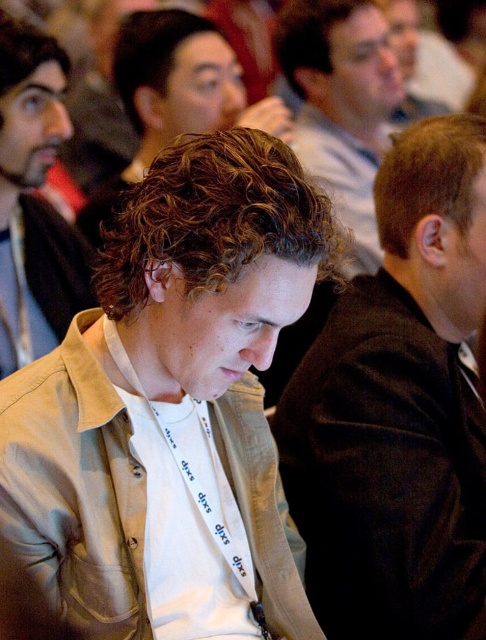
Is beige fabric shirt at center further to the viewer compared to light brown jacket at center?

That is False.

Does point (194, 532) lie behind point (36, 106)?

No, it is not.

The height and width of the screenshot is (640, 486). I want to click on beige fabric shirt at center, so click(x=172, y=406).

Identify the location of light brown jacket at center. Image resolution: width=486 pixels, height=640 pixels. (34, 200).

Between point (52, 337) and point (400, 100), which one is positioned in front?

Positioned in front is point (52, 337).

Locate an element on the screen. This screenshot has width=486, height=640. light brown jacket at center is located at coordinates coord(34,200).

Does beige fabric shirt at center appear under light brown curly hair at center?

Indeed, beige fabric shirt at center is positioned under light brown curly hair at center.

Is point (71, 616) positioned after point (161, 99)?

No, (71, 616) is in front of (161, 99).

Find the location of a particular element. This screenshot has width=486, height=640. beige fabric shirt at center is located at coordinates (172, 406).